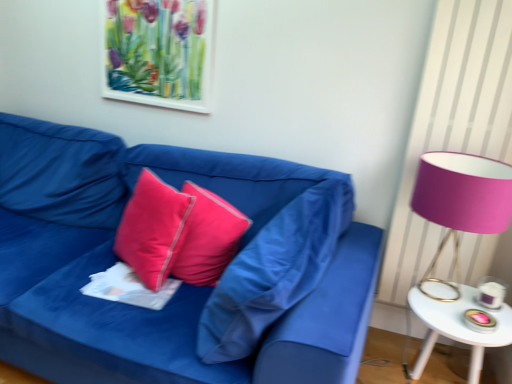
The width and height of the screenshot is (512, 384). Describe the element at coordinates (458, 327) in the screenshot. I see `white glossy side table at right` at that location.

The image size is (512, 384). Describe the element at coordinates (152, 229) in the screenshot. I see `satin pink pillow at center, acting as the 1th pillow starting from the left` at that location.

Based on the photo, in order to face silky pink pillow at center, placed as the 2th pillow when sorted from left to right, should I rotate leftwards or rightwards?

You should rotate left by 6.321 degrees.

Identify the location of white paper at center. Image resolution: width=512 pixels, height=384 pixels. (128, 288).

The height and width of the screenshot is (384, 512). Describe the element at coordinates (159, 52) in the screenshot. I see `watercolor paper picture frame at upper center` at that location.

Find the location of a particular element. This screenshot has height=384, width=512. white glossy side table at right is located at coordinates (458, 327).

From the image's perspective, which one is positioned lower, silky pink pillow at center, which ranks as the second pillow in right-to-left order, or watercolor paper picture frame at upper center?

silky pink pillow at center, which ranks as the second pillow in right-to-left order.

Is silky pink pillow at center, which ranks as the second pillow in right-to-left order, located outside watercolor paper picture frame at upper center?

silky pink pillow at center, which ranks as the second pillow in right-to-left order, lies outside watercolor paper picture frame at upper center's area.

Which of these two, silky pink pillow at center, which ranks as the second pillow in right-to-left order, or watercolor paper picture frame at upper center, is wider?

silky pink pillow at center, which ranks as the second pillow in right-to-left order.

Between silky pink pillow at center, placed as the 2th pillow when sorted from left to right, and watercolor paper picture frame at upper center, which one appears on the right side from the viewer's perspective?

silky pink pillow at center, placed as the 2th pillow when sorted from left to right, is more to the right.

In the scene shown: Would you consider matte pink pillow at center, which appears as the 1th pillow when viewed from the right, to be distant from matte blue fabric couch at center?

That's not correct — matte pink pillow at center, which appears as the 1th pillow when viewed from the right, is a little close to matte blue fabric couch at center.

Can you confirm if matte pink pillow at center, which appears as the 1th pillow when viewed from the right, is wider than matte blue fabric couch at center?

No.

Is matte pink pillow at center, the third pillow when ordered from left to right, inside the boundaries of matte blue fabric couch at center, or outside?

matte pink pillow at center, the third pillow when ordered from left to right, fits inside matte blue fabric couch at center.

How many degrees apart are the facing directions of matte pink pillow at center, which appears as the 1th pillow when viewed from the right, and matte blue fabric couch at center?

The facing directions of matte pink pillow at center, which appears as the 1th pillow when viewed from the right, and matte blue fabric couch at center are 97.1 degrees apart.

What's the angular difference between satin pink pillow at center, the 3th pillow when ordered from right to left, and matte blue fabric couch at center's facing directions?

satin pink pillow at center, the 3th pillow when ordered from right to left, and matte blue fabric couch at center are facing 27.7 degrees away from each other.

Does satin pink pillow at center, acting as the 1th pillow starting from the left, have a smaller size compared to matte blue fabric couch at center?

Yes, satin pink pillow at center, acting as the 1th pillow starting from the left, is smaller than matte blue fabric couch at center.

From the image's perspective, does satin pink pillow at center, acting as the 1th pillow starting from the left, appear lower than matte blue fabric couch at center?

Actually, satin pink pillow at center, acting as the 1th pillow starting from the left, appears above matte blue fabric couch at center in the image.

From a real-world perspective, is white paper at center positioned above or below watercolor paper picture frame at upper center?

In terms of real-world spatial position, white paper at center is below watercolor paper picture frame at upper center.

From the image's perspective, is white paper at center above or below watercolor paper picture frame at upper center?

Clearly, from the image's perspective, white paper at center is below watercolor paper picture frame at upper center.

Can you confirm if white paper at center is wider than watercolor paper picture frame at upper center?

Correct, the width of white paper at center exceeds that of watercolor paper picture frame at upper center.

Locate an element on the screen. picture frame behind the white paper at center is located at coordinates (159, 52).

Is satin pink pillow at center, the 3th pillow when ordered from right to left, at the right side of silky pink pillow at center, placed as the 2th pillow when sorted from left to right?

Incorrect, satin pink pillow at center, the 3th pillow when ordered from right to left, is not on the right side of silky pink pillow at center, placed as the 2th pillow when sorted from left to right.

From a real-world perspective, relative to silky pink pillow at center, placed as the 2th pillow when sorted from left to right, is satin pink pillow at center, acting as the 1th pillow starting from the left, vertically above or below?

satin pink pillow at center, acting as the 1th pillow starting from the left, is situated lower than silky pink pillow at center, placed as the 2th pillow when sorted from left to right, in the real world.

Is point (140, 263) closer to viewer compared to point (223, 226)?

Yes, point (140, 263) is closer to viewer.

From the image's perspective, which is above, satin pink pillow at center, the 3th pillow when ordered from right to left, or silky pink pillow at center, placed as the 2th pillow when sorted from left to right?

satin pink pillow at center, the 3th pillow when ordered from right to left, from the image's perspective.

Is pink fabric lampshade at right far away from silky pink pillow at center, placed as the 2th pillow when sorted from left to right?

No, pink fabric lampshade at right is not far from silky pink pillow at center, placed as the 2th pillow when sorted from left to right.

From a real-world perspective, which is physically below, pink fabric lampshade at right or silky pink pillow at center, placed as the 2th pillow when sorted from left to right?

From a 3D spatial view, silky pink pillow at center, placed as the 2th pillow when sorted from left to right, is below.

Considering the points (492, 165) and (196, 259), which point is behind, point (492, 165) or point (196, 259)?

The point (196, 259) is more distant.

Which of these two, pink fabric lampshade at right or silky pink pillow at center, placed as the 2th pillow when sorted from left to right, stands shorter?

Standing shorter between the two is silky pink pillow at center, placed as the 2th pillow when sorted from left to right.

Between matte blue fabric couch at center and watercolor paper picture frame at upper center, which one has smaller size?

Smaller between the two is watercolor paper picture frame at upper center.

From a real-world perspective, is matte blue fabric couch at center physically located above or below watercolor paper picture frame at upper center?

matte blue fabric couch at center is situated lower than watercolor paper picture frame at upper center in the real world.

From their relative heights in the image, would you say matte blue fabric couch at center is taller or shorter than watercolor paper picture frame at upper center?

Clearly, matte blue fabric couch at center is taller compared to watercolor paper picture frame at upper center.

Are matte blue fabric couch at center and watercolor paper picture frame at upper center far apart?

No, matte blue fabric couch at center is not far away from watercolor paper picture frame at upper center.

Identify the location of picture frame behind the silky pink pillow at center, which ranks as the second pillow in right-to-left order. The image size is (512, 384). (159, 52).

Find the location of a particular element. The image size is (512, 384). studio couch that appears below the matte pink pillow at center, the third pillow when ordered from left to right (from the image's perspective) is located at coordinates [181, 286].

When comparing their distances from satin pink pillow at center, acting as the 1th pillow starting from the left, does watercolor paper picture frame at upper center or matte blue fabric couch at center seem closer?

The object closer to satin pink pillow at center, acting as the 1th pillow starting from the left, is matte blue fabric couch at center.

When comparing their distances from matte blue fabric couch at center, does pink fabric lampshade at right or matte pink pillow at center, the third pillow when ordered from left to right, seem further?

Among the two, pink fabric lampshade at right is located further to matte blue fabric couch at center.

Considering their positions, is watercolor paper picture frame at upper center positioned further to pink fabric lampshade at right than white paper at center?

watercolor paper picture frame at upper center.

When comparing their distances from matte pink pillow at center, the third pillow when ordered from left to right, does white glossy side table at right or satin pink pillow at center, acting as the 1th pillow starting from the left, seem further?

Among the two, white glossy side table at right is located further to matte pink pillow at center, the third pillow when ordered from left to right.

Based on their spatial positions, is pink fabric lampshade at right or satin pink pillow at center, the 3th pillow when ordered from right to left, closer to watercolor paper picture frame at upper center?

satin pink pillow at center, the 3th pillow when ordered from right to left, is closer to watercolor paper picture frame at upper center.

Considering their positions, is matte blue fabric couch at center positioned closer to watercolor paper picture frame at upper center than white glossy side table at right?

matte blue fabric couch at center lies closer to watercolor paper picture frame at upper center than the other object.

Considering their positions, is matte blue fabric couch at center positioned closer to silky pink pillow at center, placed as the 2th pillow when sorted from left to right, than white paper at center?

white paper at center is closer to silky pink pillow at center, placed as the 2th pillow when sorted from left to right.

Estimate the real-world distances between objects in this image. Which object is further from white paper at center, watercolor paper picture frame at upper center or satin pink pillow at center, acting as the 1th pillow starting from the left?

watercolor paper picture frame at upper center.

Locate an element on the screen. The width and height of the screenshot is (512, 384). picture frame between matte blue fabric couch at center and white glossy side table at right in the horizontal direction is located at coordinates (159, 52).

The height and width of the screenshot is (384, 512). What are the coordinates of `table between satin pink pillow at center, acting as the 1th pillow starting from the left, and pink fabric lampshade at right` in the screenshot? It's located at (458, 327).

Image resolution: width=512 pixels, height=384 pixels. What are the coordinates of `sheet between watercolor paper picture frame at upper center and white glossy side table at right` in the screenshot? It's located at (x=128, y=288).

At what (x,y) coordinates should I click in order to perform the action: click on table between matte blue fabric couch at center and pink fabric lampshade at right. Please return your answer as a coordinate pair (x, y). The width and height of the screenshot is (512, 384). Looking at the image, I should click on (458, 327).